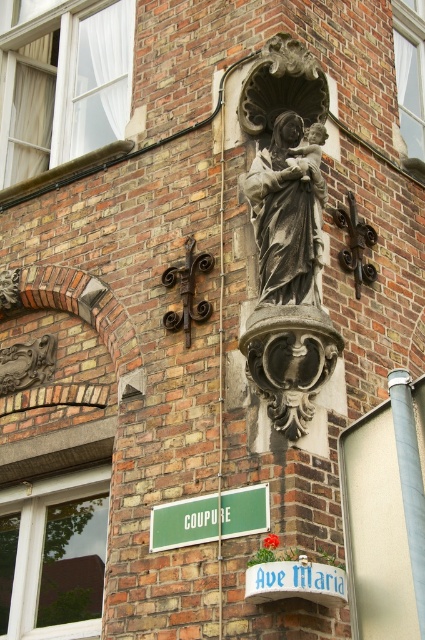
You are a maintenance worker inspecting the brick building. You notice the gray stone statue at center and the green matte sign at lower center. Which object is located higher up on the wall?

The gray stone statue at center is positioned over the green matte sign at lower center, so it is higher up on the wall.

You are an artist planning to sketch the brick building. You notice the gray stone statue at center and the green matte sign at lower center. Which object should you focus on first if you want to draw the larger one first?

The gray stone statue at center is bigger than the green matte sign at lower center, so you should focus on drawing the gray stone statue at center first.